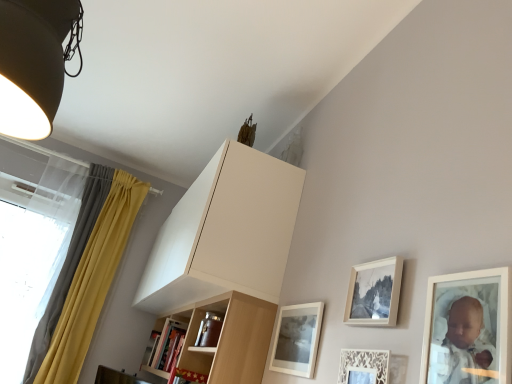
Measure the distance between point (30, 17) and camera.

3.55 feet.

In order to face matte black lampshade at upper left, should I rotate leftwards or rightwards?

Rotate left and turn 27.088 degrees.

The image size is (512, 384). What do you see at coordinates (85, 275) in the screenshot?
I see `yellow fabric curtain at left` at bounding box center [85, 275].

The image size is (512, 384). Identify the location of matte white picture frame at upper right, marked as the 3th picture frame in a front-to-back arrangement. (374, 293).

Where is `wooden shelf at lower left`? wooden shelf at lower left is located at coordinates (166, 348).

From a real-world perspective, who is located lower, white lace picture frame at lower right, the 2th picture frame in the front-to-back sequence, or white matte cabinet at upper center?

In real-world perspective, white lace picture frame at lower right, the 2th picture frame in the front-to-back sequence, is lower.

Looking at the image, does white lace picture frame at lower right, which is counted as the 3th picture frame, starting from the back, seem bigger or smaller compared to white matte cabinet at upper center?

white lace picture frame at lower right, which is counted as the 3th picture frame, starting from the back, is smaller than white matte cabinet at upper center.

Between white lace picture frame at lower right, the 2th picture frame in the front-to-back sequence, and white matte cabinet at upper center, which one has more height?

With more height is white matte cabinet at upper center.

Is white lace picture frame at lower right, the 2th picture frame in the front-to-back sequence, oriented away from white matte cabinet at upper center?

white lace picture frame at lower right, the 2th picture frame in the front-to-back sequence, does not have its back to white matte cabinet at upper center.

Which object is closer to the camera taking this photo, wooden shelf at lower left or matte white picture frame at lower center, the 4th picture frame in the front-to-back sequence?

Positioned in front is matte white picture frame at lower center, the 4th picture frame in the front-to-back sequence.

Is wooden shelf at lower left aimed at matte white picture frame at lower center, the 4th picture frame in the front-to-back sequence?

No.

Which is more to the left, wooden shelf at lower left or matte white picture frame at lower center, the 4th picture frame in the front-to-back sequence?

Positioned to the left is wooden shelf at lower left.

Is white matte cabinet at upper center smaller than matte white picture frame at lower center, the 4th picture frame in the front-to-back sequence?

No, white matte cabinet at upper center is not smaller than matte white picture frame at lower center, the 4th picture frame in the front-to-back sequence.

From the picture: Between white matte cabinet at upper center and matte white picture frame at lower center, which is the first picture frame in back-to-front order, which one has larger width?

white matte cabinet at upper center is wider.

Is white matte cabinet at upper center oriented towards matte white picture frame at lower center, the 4th picture frame in the front-to-back sequence?

No.

Is point (248, 284) closer to camera compared to point (283, 351)?

No, it is not.

Based on their sizes in the image, would you say matte black lampshade at upper left is bigger or smaller than matte white picture frame at lower center, the 4th picture frame in the front-to-back sequence?

Considering their sizes, matte black lampshade at upper left takes up more space than matte white picture frame at lower center, the 4th picture frame in the front-to-back sequence.

Which object is positioned more to the right, matte black lampshade at upper left or matte white picture frame at lower center, the 4th picture frame in the front-to-back sequence?

matte white picture frame at lower center, the 4th picture frame in the front-to-back sequence, is more to the right.

Which object is thinner, matte black lampshade at upper left or matte white picture frame at lower center, which is the first picture frame in back-to-front order?

matte white picture frame at lower center, which is the first picture frame in back-to-front order, is thinner.

Is matte black lampshade at upper left outside of matte white picture frame at lower center, which is the first picture frame in back-to-front order?

Yes, matte black lampshade at upper left is outside of matte white picture frame at lower center, which is the first picture frame in back-to-front order.

Which is in front, white lace picture frame at lower right, the 2th picture frame in the front-to-back sequence, or matte black lampshade at upper left?

matte black lampshade at upper left.

Is white lace picture frame at lower right, the 2th picture frame in the front-to-back sequence, bigger or smaller than matte black lampshade at upper left?

Considering their sizes, white lace picture frame at lower right, the 2th picture frame in the front-to-back sequence, takes up less space than matte black lampshade at upper left.

This screenshot has height=384, width=512. Find the location of `the 2nd picture frame to the right of the matte black lampshade at upper left, starting your count from the anchor`. the 2nd picture frame to the right of the matte black lampshade at upper left, starting your count from the anchor is located at coordinates (364, 366).

Considering the points (340, 361) and (2, 99), which point is behind, point (340, 361) or point (2, 99)?

Positioned behind is point (2, 99).

How many degrees apart are the facing directions of white lace picture frame at lower right, the 2th picture frame in the front-to-back sequence, and matte white picture frame at upper right, the second picture frame from the back?

0.804 degrees separate the facing orientations of white lace picture frame at lower right, the 2th picture frame in the front-to-back sequence, and matte white picture frame at upper right, the second picture frame from the back.

Image resolution: width=512 pixels, height=384 pixels. What are the coordinates of `the 1st picture frame counting from the right side of the white lace picture frame at lower right, the 2th picture frame in the front-to-back sequence` in the screenshot? It's located at (374, 293).

Would you say white lace picture frame at lower right, which is counted as the 3th picture frame, starting from the back, is inside or outside matte white picture frame at upper right, marked as the 3th picture frame in a front-to-back arrangement?

white lace picture frame at lower right, which is counted as the 3th picture frame, starting from the back, is outside matte white picture frame at upper right, marked as the 3th picture frame in a front-to-back arrangement.

Considering the sizes of objects white lace picture frame at lower right, which is counted as the 3th picture frame, starting from the back, and matte white picture frame at upper right, the second picture frame from the back, in the image provided, who is shorter, white lace picture frame at lower right, which is counted as the 3th picture frame, starting from the back, or matte white picture frame at upper right, the second picture frame from the back,?

With less height is matte white picture frame at upper right, the second picture frame from the back.

Is matte white picture frame at upper right, the fourth picture frame from the back, positioned with its back to translucent fabric at left?

matte white picture frame at upper right, the fourth picture frame from the back, is not turned away from translucent fabric at left.

Looking at this image, from a real-world perspective, relative to translucent fabric at left, is matte white picture frame at upper right, which appears as the 1th picture frame when viewed from the front, vertically above or below?

matte white picture frame at upper right, which appears as the 1th picture frame when viewed from the front, is situated lower than translucent fabric at left in the real world.

How many degrees apart are the facing directions of matte white picture frame at upper right, which appears as the 1th picture frame when viewed from the front, and translucent fabric at left?

The angular difference between matte white picture frame at upper right, which appears as the 1th picture frame when viewed from the front, and translucent fabric at left is 92.2 degrees.

Is matte white picture frame at upper right, which appears as the 1th picture frame when viewed from the front, taller than translucent fabric at left?

No.

This screenshot has height=384, width=512. There is a white lace picture frame at lower right, the 2th picture frame in the front-to-back sequence. In order to click on cabinetry above it (from a real-world perspective) in this screenshot , I will do `click(225, 232)`.

Locate an element on the screen. The height and width of the screenshot is (384, 512). the 1st picture frame in front of the wooden shelf at lower left is located at coordinates (297, 339).

Looking at the image, which one is located closer to white lace picture frame at lower right, which is counted as the 3th picture frame, starting from the back, yellow fabric curtain at left or matte white picture frame at lower center, the 4th picture frame in the front-to-back sequence?

matte white picture frame at lower center, the 4th picture frame in the front-to-back sequence, is positioned closer to the anchor white lace picture frame at lower right, which is counted as the 3th picture frame, starting from the back.

Based on the photo, looking at the image, which one is located closer to matte white picture frame at lower center, the 4th picture frame in the front-to-back sequence, translucent fabric at left or white matte cabinet at upper center?

white matte cabinet at upper center lies closer to matte white picture frame at lower center, the 4th picture frame in the front-to-back sequence, than the other object.

Which object lies nearer to the anchor point matte white picture frame at upper right, the fourth picture frame from the back, white lace picture frame at lower right, which is counted as the 3th picture frame, starting from the back, or yellow fabric curtain at left?

Based on the image, white lace picture frame at lower right, which is counted as the 3th picture frame, starting from the back, appears to be nearer to matte white picture frame at upper right, the fourth picture frame from the back.

Based on their spatial positions, is white lace picture frame at lower right, which is counted as the 3th picture frame, starting from the back, or yellow fabric curtain at left closer to translucent fabric at left?

The object closer to translucent fabric at left is yellow fabric curtain at left.

When comparing their distances from matte white picture frame at upper right, the fourth picture frame from the back, does matte black lampshade at upper left or yellow fabric curtain at left seem closer?

Among the two, matte black lampshade at upper left is located nearer to matte white picture frame at upper right, the fourth picture frame from the back.

When comparing their distances from translucent fabric at left, does matte white picture frame at lower center, which is the first picture frame in back-to-front order, or matte white picture frame at upper right, the fourth picture frame from the back, seem closer?

matte white picture frame at lower center, which is the first picture frame in back-to-front order, is positioned closer to the anchor translucent fabric at left.

In the scene shown: Which object lies nearer to the anchor point white lace picture frame at lower right, which is counted as the 3th picture frame, starting from the back, matte black lampshade at upper left or translucent fabric at left?

matte black lampshade at upper left is positioned closer to the anchor white lace picture frame at lower right, which is counted as the 3th picture frame, starting from the back.

Looking at this image, based on their spatial positions, is yellow fabric curtain at left or wooden shelf at lower left further from white lace picture frame at lower right, which is counted as the 3th picture frame, starting from the back?

yellow fabric curtain at left.

Where is `shelf between white lace picture frame at lower right, which is counted as the 3th picture frame, starting from the back, and yellow fabric curtain at left, along the z-axis`? shelf between white lace picture frame at lower right, which is counted as the 3th picture frame, starting from the back, and yellow fabric curtain at left, along the z-axis is located at coordinates (166, 348).

Identify the location of cabinetry positioned between matte white picture frame at upper right, the fourth picture frame from the back, and wooden shelf at lower left from near to far. (225, 232).

This screenshot has height=384, width=512. What are the coordinates of `cabinetry between matte black lampshade at upper left and yellow fabric curtain at left along the z-axis` in the screenshot? It's located at tap(225, 232).

Locate an element on the screen. Image resolution: width=512 pixels, height=384 pixels. picture frame located between matte white picture frame at upper right, marked as the 3th picture frame in a front-to-back arrangement, and yellow fabric curtain at left in the depth direction is located at coordinates (297, 339).